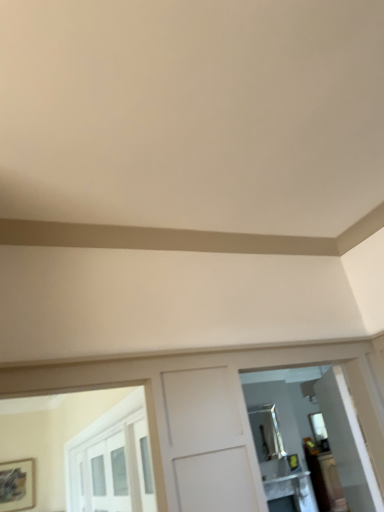
Question: Is matte silver mirror at right, placed as the second mirror when sorted from back to front, located outside white glossy table at lower right?

Choices:
 (A) yes
 (B) no

Answer: (A)

Question: From the image's perspective, is matte silver mirror at right, the 2th mirror in the bottom-to-top sequence, beneath white glossy table at lower right?

Choices:
 (A) no
 (B) yes

Answer: (A)

Question: Is matte silver mirror at right, placed as the second mirror when sorted from back to front, positioned with its back to white glossy table at lower right?

Choices:
 (A) no
 (B) yes

Answer: (A)

Question: Would you consider matte silver mirror at right, the first mirror when ordered from front to back, to be distant from white glossy table at lower right?

Choices:
 (A) yes
 (B) no

Answer: (B)

Question: From the image's perspective, is matte silver mirror at right, the first mirror when ordered from front to back, on top of white glossy table at lower right?

Choices:
 (A) no
 (B) yes

Answer: (B)

Question: Visually, is matte black picture frame at lower left positioned to the left or to the right of white glossy table at lower right?

Choices:
 (A) left
 (B) right

Answer: (A)

Question: From their relative heights in the image, would you say matte black picture frame at lower left is taller or shorter than white glossy table at lower right?

Choices:
 (A) tall
 (B) short

Answer: (A)

Question: Considering their positions, is matte black picture frame at lower left located in front of or behind white glossy table at lower right?

Choices:
 (A) behind
 (B) front

Answer: (B)

Question: Is point (23, 465) closer or farther from the camera than point (279, 486)?

Choices:
 (A) closer
 (B) farther

Answer: (B)

Question: Considering the relative positions of matte silver mirror at right, the first mirror when ordered from front to back, and white glossy table at lower right in the image provided, is matte silver mirror at right, the first mirror when ordered from front to back, to the left or to the right of white glossy table at lower right?

Choices:
 (A) left
 (B) right

Answer: (A)

Question: From a real-world perspective, is matte silver mirror at right, the 2th mirror in the bottom-to-top sequence, positioned above or below white glossy table at lower right?

Choices:
 (A) below
 (B) above

Answer: (B)

Question: In terms of height, does matte silver mirror at right, placed as the 1th mirror when sorted from top to bottom, look taller or shorter compared to white glossy table at lower right?

Choices:
 (A) short
 (B) tall

Answer: (B)

Question: Relative to white glossy table at lower right, is matte silver mirror at right, placed as the second mirror when sorted from back to front, in front or behind?

Choices:
 (A) front
 (B) behind

Answer: (A)

Question: From their relative heights in the image, would you say white glossy table at lower right is taller or shorter than matte silver mirror at right, the first mirror when ordered from front to back?

Choices:
 (A) short
 (B) tall

Answer: (A)

Question: Is white glossy table at lower right bigger or smaller than matte silver mirror at right, the 2th mirror in the bottom-to-top sequence?

Choices:
 (A) big
 (B) small

Answer: (A)